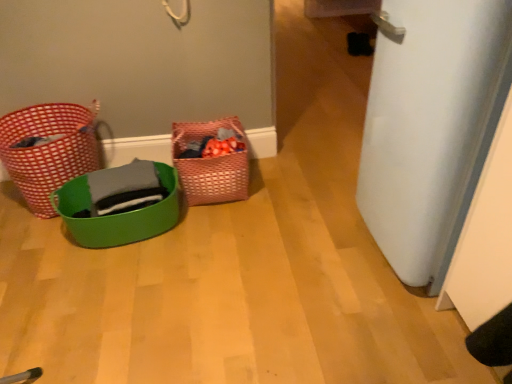
This screenshot has width=512, height=384. In order to click on space that is in front of woven pink basket at center, arranged as the 1th basket when viewed from the right in this screenshot , I will do `click(228, 223)`.